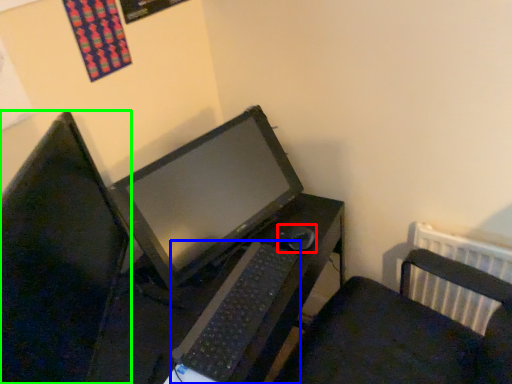
Question: Estimate the real-world distances between objects in this image. Which object is closer to mouse (highlighted by a red box), computer keyboard (highlighted by a blue box) or computer monitor (highlighted by a green box)?

Choices:
 (A) computer keyboard
 (B) computer monitor

Answer: (A)